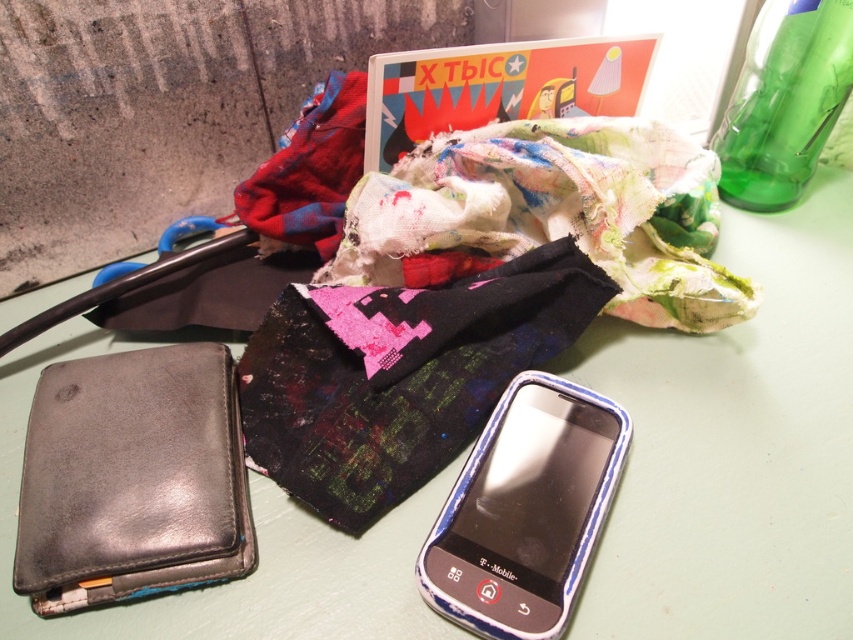
Who is positioned more to the left, multicolored patchwork cloth at center or blue plastic phone at lower right?

blue plastic phone at lower right

Is multicolored patchwork cloth at center shorter than blue plastic phone at lower right?

No.

The height and width of the screenshot is (640, 853). Find the location of `multicolored patchwork cloth at center`. multicolored patchwork cloth at center is located at coordinates (556, 212).

Who is more forward, (x=357, y=499) or (x=337, y=170)?

Point (x=357, y=499) is more forward.

Which is below, dark green fabric at center or red fabric at upper center?

dark green fabric at center is lower down.

The width and height of the screenshot is (853, 640). What do you see at coordinates (399, 374) in the screenshot?
I see `dark green fabric at center` at bounding box center [399, 374].

Identify the location of dark green fabric at center. This screenshot has height=640, width=853. (x=399, y=374).

Is point (521, 252) more distant than point (341, 112)?

That is False.

Does point (665, 243) lie in front of point (318, 170)?

No, (665, 243) is behind (318, 170).

You are a GUI agent. You are given a task and a screenshot of the screen. Output one action in this format:
    pyautogui.click(x=<x>, y=<y>)
    Task: Click on the multicolored patchwork cloth at center
    Image resolution: width=853 pixels, height=640 pixels.
    Given the screenshot: What is the action you would take?
    pyautogui.click(x=556, y=212)